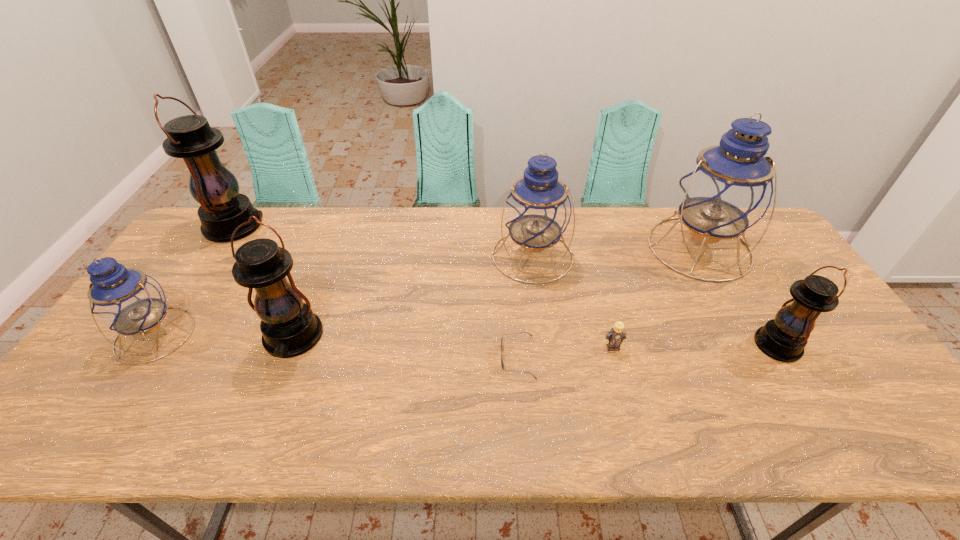
Where is `the leftmost black lantern`? The width and height of the screenshot is (960, 540). the leftmost black lantern is located at coordinates (223, 209).

The image size is (960, 540). I want to click on the farthest black lantern, so click(x=223, y=209).

Identify the location of the biggest blue lantern. The image size is (960, 540). 730,186.

Locate an element on the screen. This screenshot has width=960, height=540. the second biggest blue lantern is located at coordinates (537, 212).

Locate an element on the screen. the fourth lantern from left to right is located at coordinates (537, 212).

At what (x,y) coordinates should I click in order to perform the action: click on the sixth object from right to left. Please return your answer as a coordinate pair (x, y). Looking at the image, I should click on (289, 327).

What are the coordinates of `the second smallest black lantern` in the screenshot? It's located at (289, 327).

Where is `the rightmost black lantern`? the rightmost black lantern is located at coordinates (784, 338).

This screenshot has height=540, width=960. Identify the location of the smallest blue lantern. (124, 299).

Where is `the leftmost blue lantern`? the leftmost blue lantern is located at coordinates (124, 299).